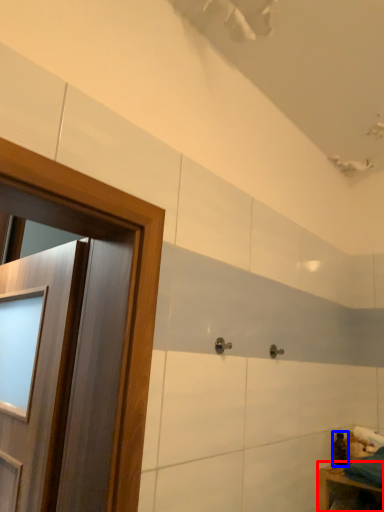
Question: Which object appears farthest to the camera in this image, furniture (highlighted by a red box) or toiletry (highlighted by a blue box)?

Choices:
 (A) furniture
 (B) toiletry

Answer: (B)